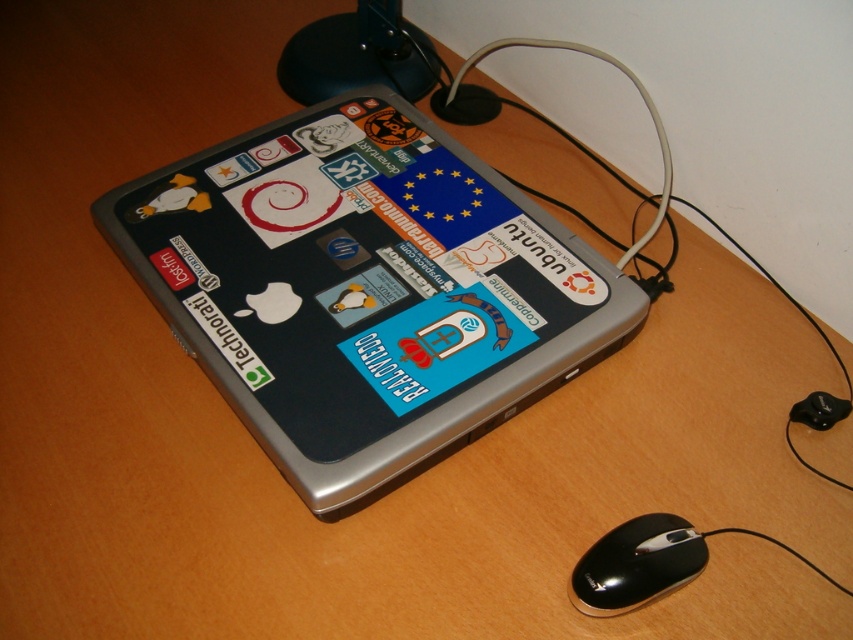
Question: Is silver metallic laptop at center positioned behind black plastic mouse at lower right?

Choices:
 (A) yes
 (B) no

Answer: (A)

Question: Does silver metallic laptop at center appear on the right side of black plastic mouse at lower right?

Choices:
 (A) no
 (B) yes

Answer: (A)

Question: Is silver metallic laptop at center below black plastic mouse at lower right?

Choices:
 (A) no
 (B) yes

Answer: (A)

Question: Which point is closer to the camera?

Choices:
 (A) black plastic mouse at lower right
 (B) silver metallic laptop at center

Answer: (A)